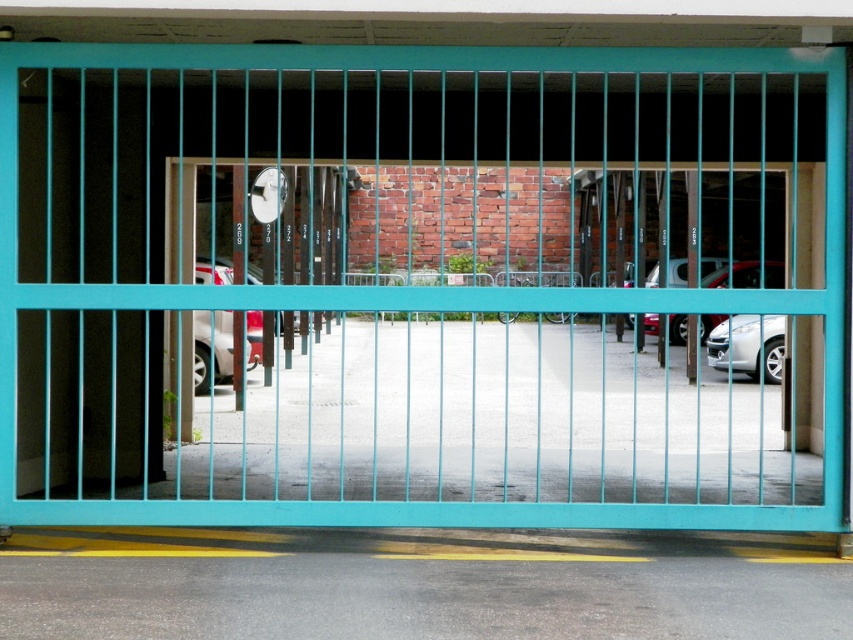
Question: Which is farther from the white glossy car at center?

Choices:
 (A) silver metallic sedan at center
 (B) satin silver car at center

Answer: (A)

Question: Does satin silver car at center have a lesser width compared to silver metallic sedan at center?

Choices:
 (A) yes
 (B) no

Answer: (A)

Question: Is satin silver car at center below silver metallic sedan at center?

Choices:
 (A) yes
 (B) no

Answer: (A)

Question: Among these points, which one is farthest from the camera?

Choices:
 (A) (764, 278)
 (B) (215, 273)

Answer: (A)

Question: Does white glossy car at center appear over silver metallic sedan at center?

Choices:
 (A) no
 (B) yes

Answer: (A)

Question: Considering the real-world distances, which object is farthest from the satin silver car at center?

Choices:
 (A) silver metallic sedan at center
 (B) white glossy car at center

Answer: (B)